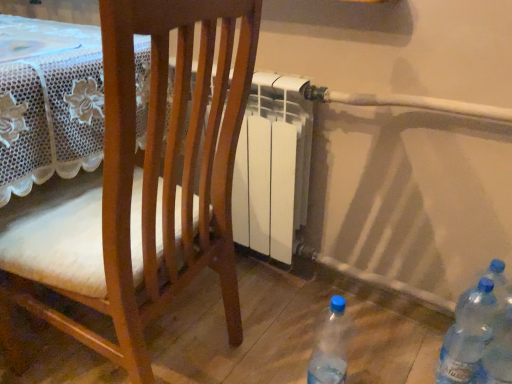
Locate an element on the screen. vacant area situated to the left side of transparent plastic bottles at lower right, placed as the 2th bottle when sorted from right to left is located at coordinates (387, 363).